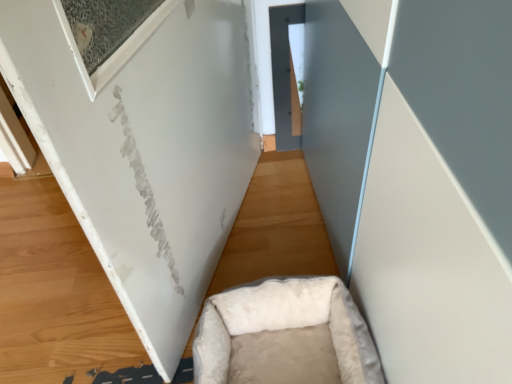
Image resolution: width=512 pixels, height=384 pixels. In order to click on vacant area on top of white fluffy pet bed at lower center (from a real-world perspective) in this screenshot , I will do `click(103, 281)`.